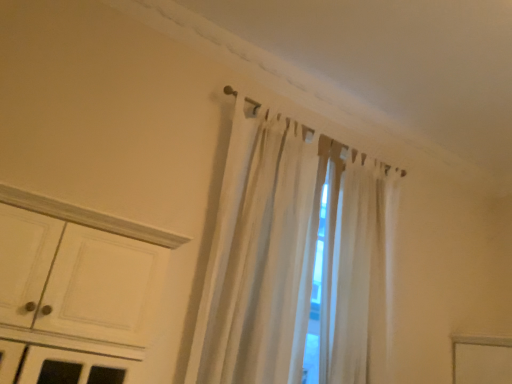
What do you see at coordinates (292, 257) in the screenshot?
I see `white sheer curtain at upper center` at bounding box center [292, 257].

The image size is (512, 384). I want to click on white sheer curtain at upper center, so click(292, 257).

Locate an element on the screen. The image size is (512, 384). white sheer curtain at upper center is located at coordinates (292, 257).